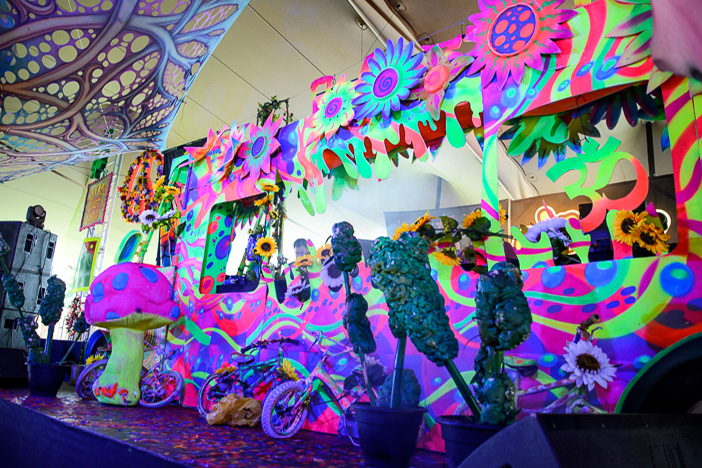
Locate an element on the screen. This screenshot has height=468, width=702. ceiling is located at coordinates (314, 33).